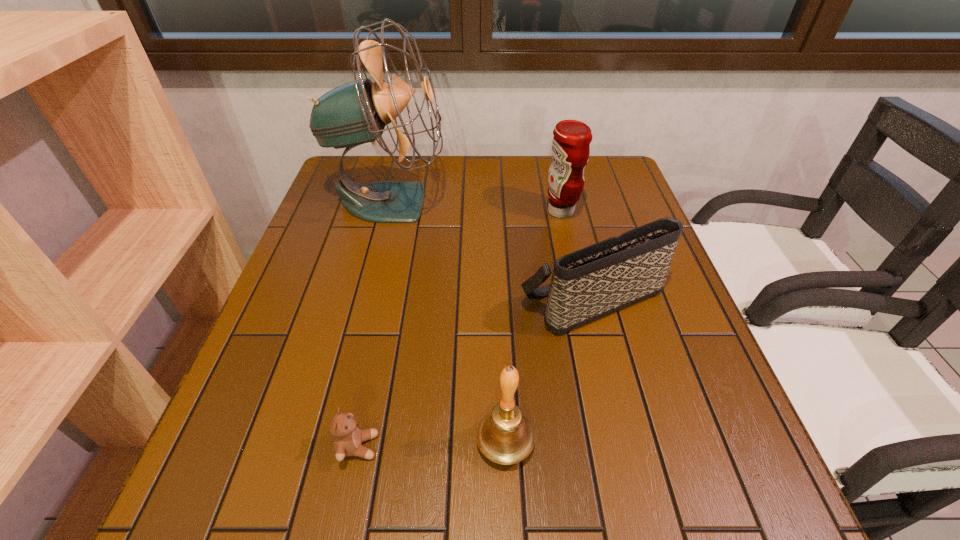
This screenshot has height=540, width=960. Find the location of `vacant space at the far right corner`. vacant space at the far right corner is located at coordinates (607, 166).

You are a GUI agent. You are given a task and a screenshot of the screen. Output one action in this format:
    pyautogui.click(x=<x>, y=<y>)
    Task: Click on the vacant region between the bell and the third nearest object
    Image resolution: width=960 pixels, height=540 pixels.
    Given the screenshot: What is the action you would take?
    pyautogui.click(x=548, y=371)

Identify the location of vacant point located between the condiment and the fan. [475, 207].

Where is `vacant region between the condiment and the bell`? Image resolution: width=960 pixels, height=540 pixels. vacant region between the condiment and the bell is located at coordinates (533, 327).

This screenshot has width=960, height=540. What are the coordinates of `free space between the condiment and the shortest object` in the screenshot? It's located at (460, 329).

Locate an element on the screen. free space between the shortest object and the bell is located at coordinates (432, 444).

You are a GUI agent. You are given a task and a screenshot of the screen. Output one action in this format:
    pyautogui.click(x=<x>, y=<y>)
    Task: Click on the free space between the teddy bear and the bell
    This screenshot has width=960, height=540.
    Given the screenshot: What is the action you would take?
    pyautogui.click(x=432, y=444)

Locate an element on the screen. The image size is (960, 540). free spot between the fan and the condiment is located at coordinates (475, 207).

Image resolution: width=960 pixels, height=540 pixels. In order to click on empty location between the shortest object and the condiment in this screenshot , I will do `click(460, 329)`.

Where is `vacant region between the bell and the teddy bear`? Image resolution: width=960 pixels, height=540 pixels. vacant region between the bell and the teddy bear is located at coordinates (432, 444).